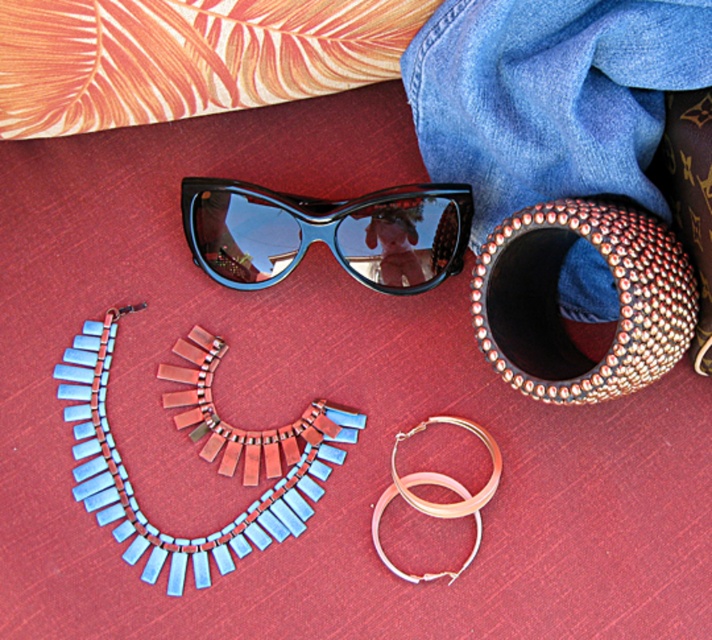
Does point (112, 348) come in front of point (434, 269)?

Yes, point (112, 348) is closer to viewer.

Is point (335, 451) positioned after point (258, 216)?

That is True.

What do you see at coordinates (199, 456) in the screenshot? I see `blue plastic necklace at center` at bounding box center [199, 456].

The width and height of the screenshot is (712, 640). I want to click on blue plastic necklace at center, so click(199, 456).

Consider the image. Which is above, blue plastic necklace at center or gold metallic hoop earrings at upper center?

blue plastic necklace at center is higher up.

Is point (281, 468) positioned behind point (476, 541)?

Yes, it is behind point (476, 541).

Measure the distance between blue plastic necklace at center and camera.

blue plastic necklace at center and camera are 3.66 feet apart.

The height and width of the screenshot is (640, 712). I want to click on blue plastic necklace at center, so click(x=199, y=456).

Does black glossy sunglasses at upper center have a lesser width compared to gold metallic hoop earrings at upper center?

In fact, black glossy sunglasses at upper center might be wider than gold metallic hoop earrings at upper center.

Consider the image. How much distance is there between black glossy sunglasses at upper center and gold metallic hoop earrings at upper center?

black glossy sunglasses at upper center and gold metallic hoop earrings at upper center are 13.04 inches apart.

Between point (298, 228) and point (434, 512), which one is positioned behind?

Point (298, 228)

Identify the location of black glossy sunglasses at upper center. (325, 232).